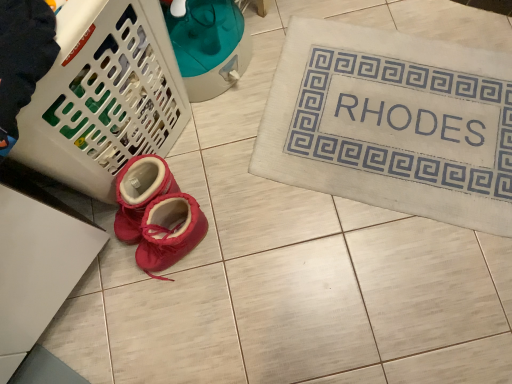
Question: Does matte pink booties at center have a lesser width compared to white plastic laundry basket at lower left?

Choices:
 (A) no
 (B) yes

Answer: (B)

Question: From the image's perspective, is matte pink booties at center under white plastic laundry basket at lower left?

Choices:
 (A) yes
 (B) no

Answer: (A)

Question: Can you confirm if matte pink booties at center is shorter than white plastic laundry basket at lower left?

Choices:
 (A) yes
 (B) no

Answer: (A)

Question: Is matte pink booties at center smaller than white plastic laundry basket at lower left?

Choices:
 (A) no
 (B) yes

Answer: (B)

Question: Is matte pink booties at center at the left side of white plastic laundry basket at lower left?

Choices:
 (A) no
 (B) yes

Answer: (A)

Question: Based on their positions, is matte pink booties at center located to the left or right of white plastic laundry basket at lower left?

Choices:
 (A) right
 (B) left

Answer: (A)

Question: Is matte pink booties at center wider or thinner than white plastic laundry basket at lower left?

Choices:
 (A) thin
 (B) wide

Answer: (A)

Question: Considering the positions of point (133, 203) and point (157, 36), is point (133, 203) closer or farther from the camera than point (157, 36)?

Choices:
 (A) closer
 (B) farther

Answer: (B)

Question: In terms of height, does matte pink booties at center look taller or shorter compared to white plastic laundry basket at lower left?

Choices:
 (A) tall
 (B) short

Answer: (B)

Question: Is beige fabric bath mat at upper right to the left or to the right of matte pink booties at center in the image?

Choices:
 (A) right
 (B) left

Answer: (A)

Question: From their relative heights in the image, would you say beige fabric bath mat at upper right is taller or shorter than matte pink booties at center?

Choices:
 (A) tall
 (B) short

Answer: (B)

Question: From a real-world perspective, is beige fabric bath mat at upper right above or below matte pink booties at center?

Choices:
 (A) below
 (B) above

Answer: (A)

Question: Considering the positions of beige fabric bath mat at upper right and matte pink booties at center in the image, is beige fabric bath mat at upper right wider or thinner than matte pink booties at center?

Choices:
 (A) thin
 (B) wide

Answer: (B)

Question: From the image's perspective, is white plastic laundry basket at lower left positioned above or below matte pink booties at center?

Choices:
 (A) below
 (B) above

Answer: (B)

Question: Based on their sizes in the image, would you say white plastic laundry basket at lower left is bigger or smaller than matte pink booties at center?

Choices:
 (A) big
 (B) small

Answer: (A)